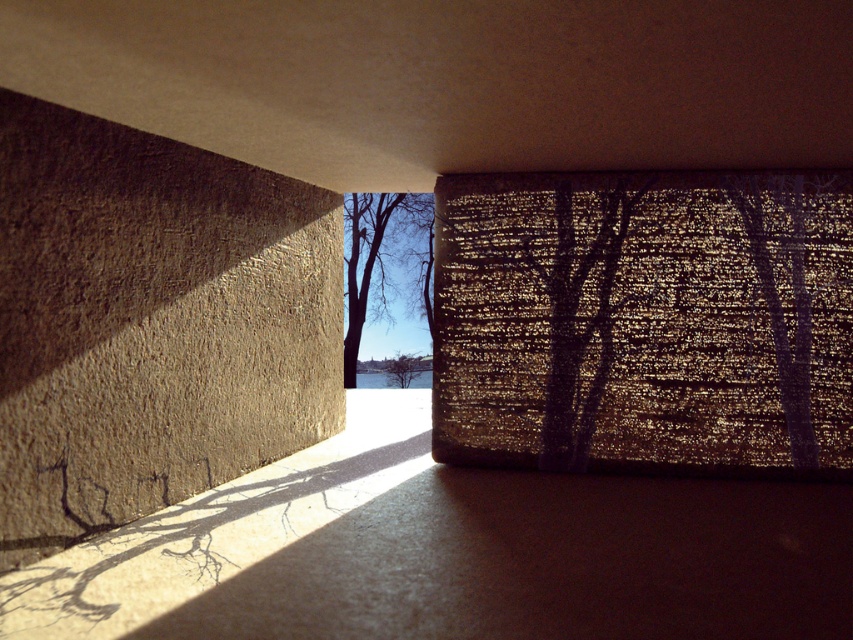
Between point (112, 378) and point (387, 292), which one is positioned behind?

Positioned behind is point (387, 292).

Which of these two, brown rough concrete at left or bare branches at center, stands taller?

bare branches at center is taller.

Where is `brown rough concrete at left`? This screenshot has width=853, height=640. brown rough concrete at left is located at coordinates (149, 323).

Who is lower down, smooth concrete wall at center or brown rough concrete at left?

smooth concrete wall at center

Who is more distant from viewer, (485, 548) or (171, 176)?

The point (171, 176) is more distant.

Locate an element on the screen. Image resolution: width=853 pixels, height=640 pixels. smooth concrete wall at center is located at coordinates (450, 552).

Between textured glass window at center and bare branches at center, which one is positioned lower?

textured glass window at center

Does textured glass window at center have a greater height compared to bare branches at center?

In fact, textured glass window at center may be shorter than bare branches at center.

Is point (469, 392) in front of point (376, 196)?

Yes, point (469, 392) is in front of point (376, 196).

In order to click on textured glass window at center in this screenshot , I will do `click(643, 321)`.